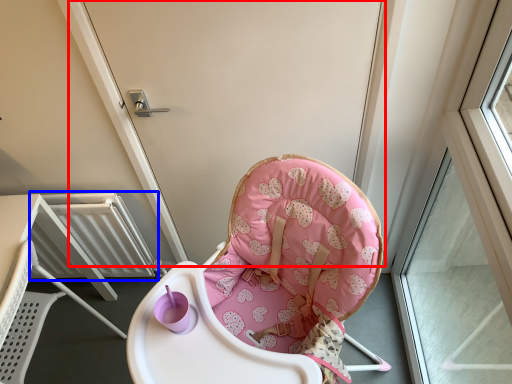
Question: Which object is further to the camera taking this photo, screen door (highlighted by a red box) or radiator (highlighted by a blue box)?

Choices:
 (A) screen door
 (B) radiator

Answer: (B)